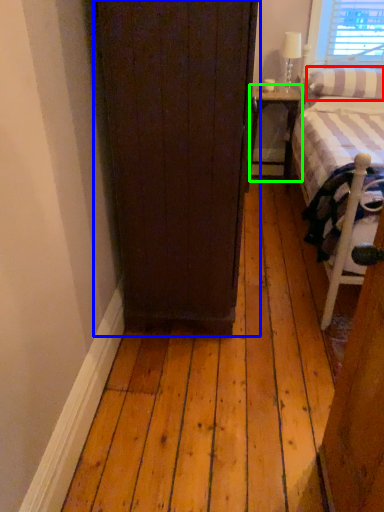
Question: Based on their relative distances, which object is farther from pillow (highlighted by a red box)? Choose from door (highlighted by a blue box) and nightstand (highlighted by a green box).

Choices:
 (A) door
 (B) nightstand

Answer: (A)